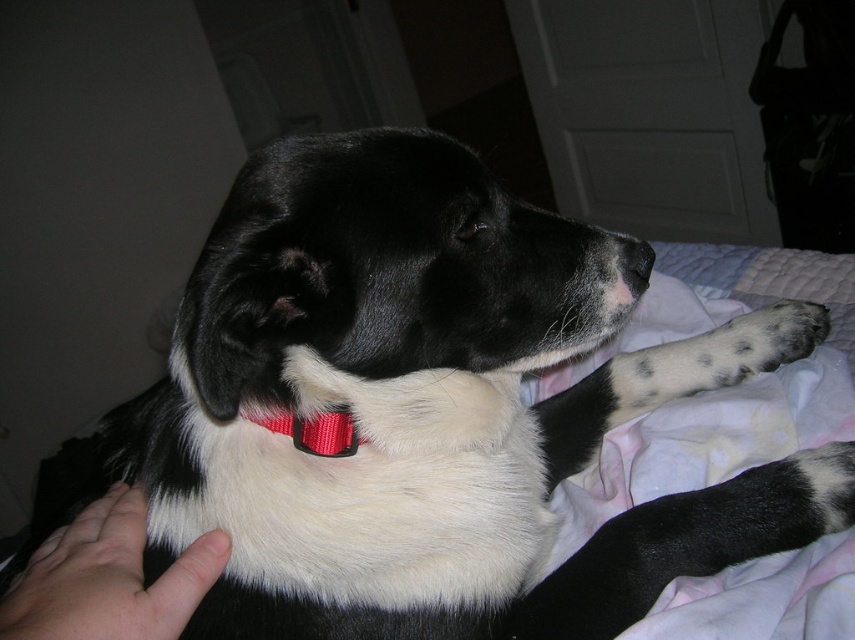
You are a veterinarian examining a dog in a warm room. You notice the red nylon collar at center and the black matte nose at center. Which object is larger?

The black matte nose at center is larger than the red nylon collar at center.